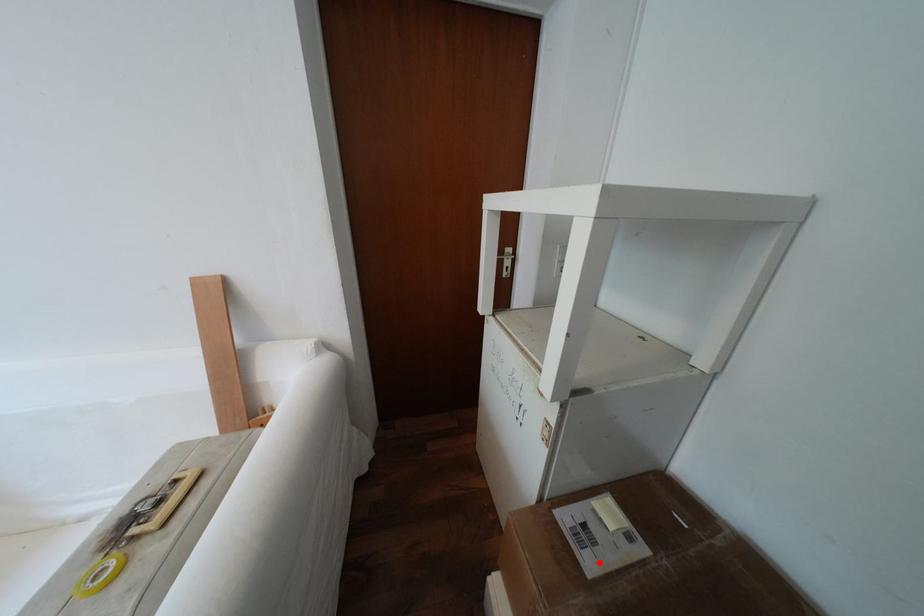
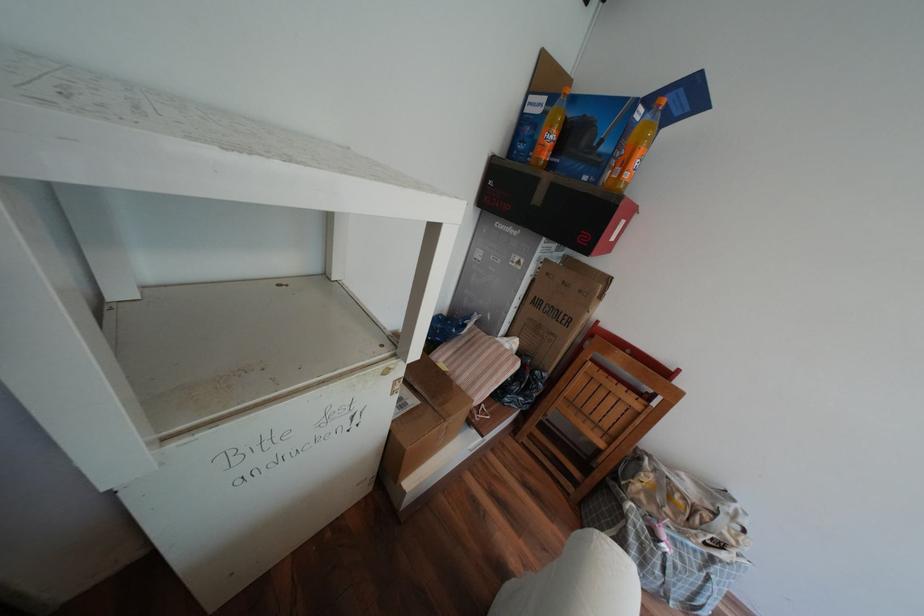
Where in the second image is the point corresponding to the highlighted location from the first image?

(422, 400)